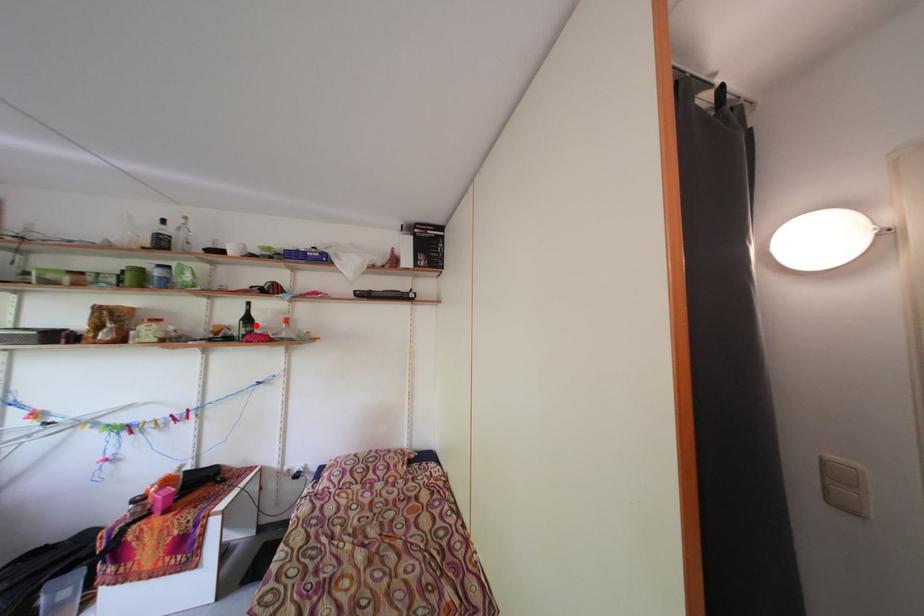
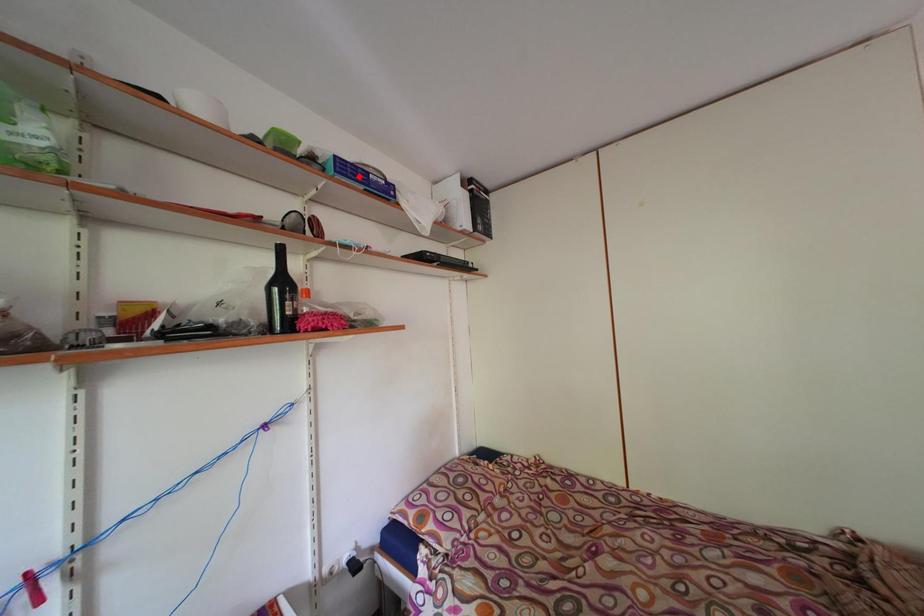
I am providing you with two images of the same scene from different viewpoints. A red point is marked on the first image and another point is marked on the second image. Are the points marked in image1 and image2 representing the same 3D position?

No